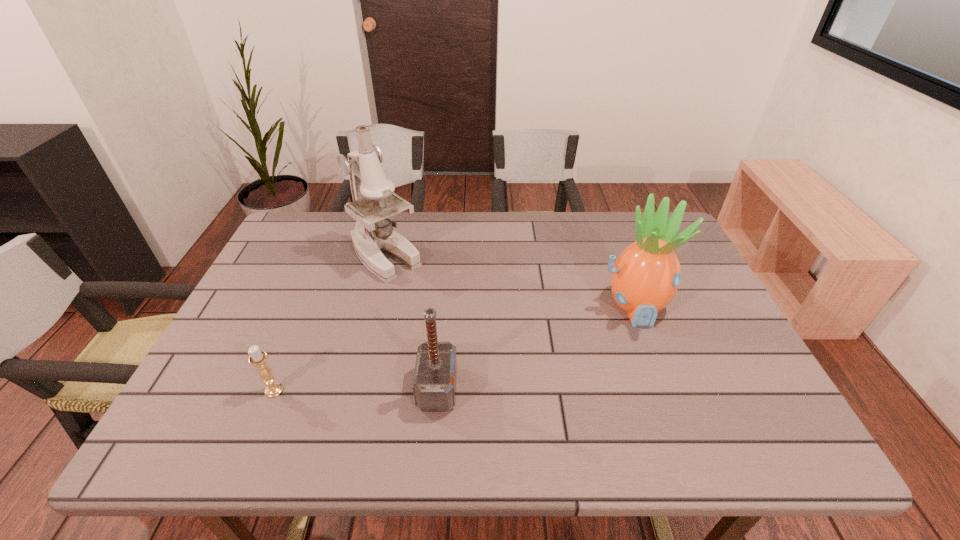
Where is `object identified as the third closest to the pineapple`? object identified as the third closest to the pineapple is located at coordinates (258, 358).

You are a GUI agent. You are given a task and a screenshot of the screen. Output one action in this format:
    pyautogui.click(x=<x>, y=<y>)
    Task: Click on the vacant space that satisfies the following two spatial constraints: 1. on the back side of the candle holder; 2. on the left side of the hammer
    
    Given the screenshot: What is the action you would take?
    pyautogui.click(x=275, y=389)